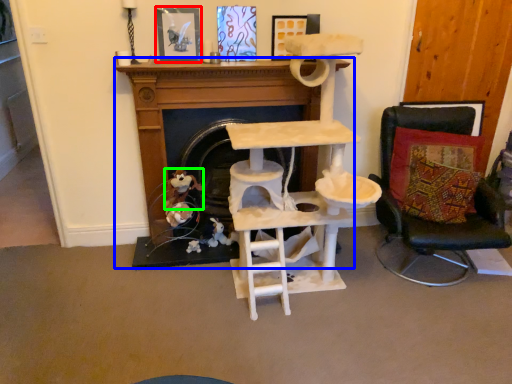
Question: Considering the real-world distances, which object is closest to picture frame (highlighted by a red box)? fireplace (highlighted by a blue box) or toy (highlighted by a green box).

Choices:
 (A) fireplace
 (B) toy

Answer: (A)